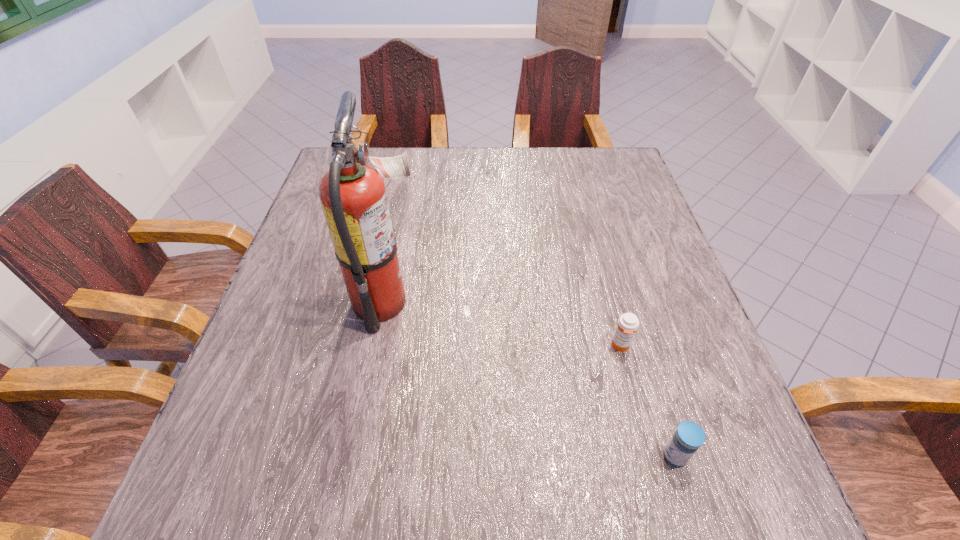
Where is `free spot between the second object from left to right and the leftmost object`? This screenshot has width=960, height=540. free spot between the second object from left to right and the leftmost object is located at coordinates (504, 324).

Locate an element on the screen. The height and width of the screenshot is (540, 960). vacant area between the tallest object and the rightmost object is located at coordinates (532, 379).

This screenshot has width=960, height=540. In order to click on vacant space in between the farther medicine and the tallest object in this screenshot , I will do `click(504, 324)`.

Find the location of `free spot between the second object from left to right and the rightmost object`. free spot between the second object from left to right and the rightmost object is located at coordinates (648, 401).

The width and height of the screenshot is (960, 540). Find the location of `free spot between the fire extinguisher and the left medicine`. free spot between the fire extinguisher and the left medicine is located at coordinates (504, 324).

Locate an element on the screen. The height and width of the screenshot is (540, 960). vacant space in between the leftmost object and the left medicine is located at coordinates (504, 324).

Where is `object that is the second closest to the second object from left to right`? object that is the second closest to the second object from left to right is located at coordinates (353, 196).

Where is `object that is the second nearest to the leftmost object`? object that is the second nearest to the leftmost object is located at coordinates (689, 436).

Where is `free space that satisfies the following two spatial constraints: 1. from the nozzle of the fire extinguisher; 2. on the left side of the nearer medicine`? free space that satisfies the following two spatial constraints: 1. from the nozzle of the fire extinguisher; 2. on the left side of the nearer medicine is located at coordinates (359, 456).

Find the location of a particular element. The image size is (960, 540). vacant space that satisfies the following two spatial constraints: 1. on the back side of the second object from left to right; 2. from the nozzle of the leftmost object is located at coordinates (610, 302).